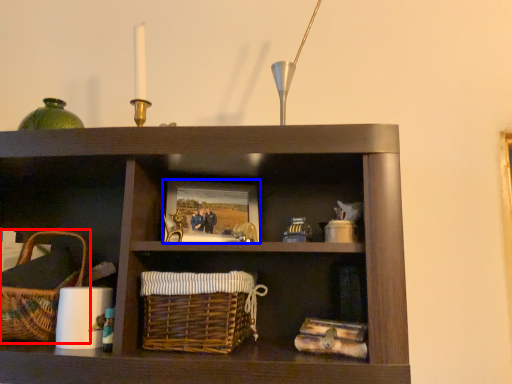
Question: Which point is further to the camera, picnic basket (highlighted by a red box) or picture frame (highlighted by a blue box)?

Choices:
 (A) picnic basket
 (B) picture frame

Answer: (B)